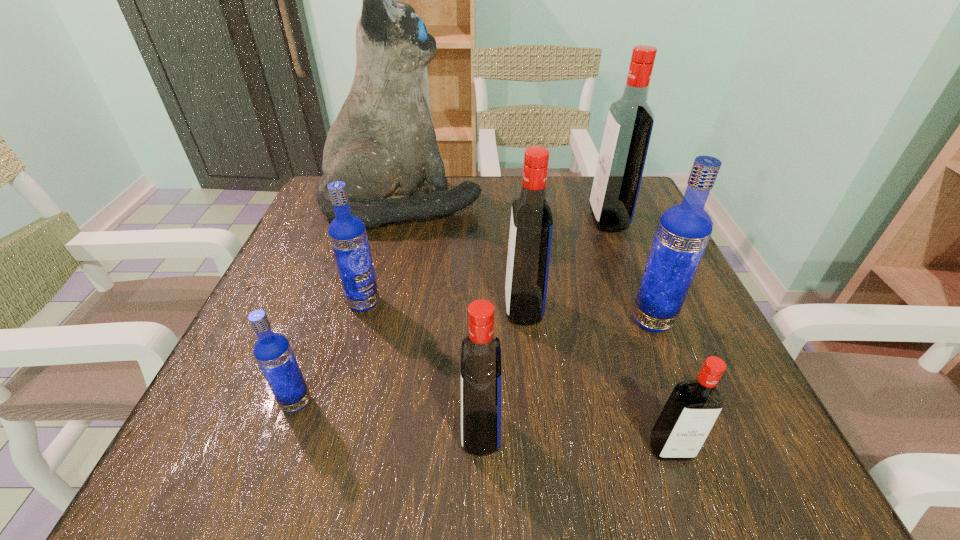
At what (x,y) coordinates should I click in order to perform the action: click on blue vodka that stands as the closest to the leftmost vodka. Please return your answer as a coordinate pair (x, y). Looking at the image, I should click on (347, 233).

Identify the location of the second closest blue vodka to the sixth vodka from right to left. (683, 232).

Identify the location of vacant space that satisfies the following two spatial constraints: 1. on the front and back of the fourth vodka from left to right; 2. on the right side of the rightmost blue vodka. (525, 320).

Where is `free space that satisfies the following two spatial constraints: 1. on the front and back of the farthest red vodka; 2. on the front side of the second biggest blue vodka`? free space that satisfies the following two spatial constraints: 1. on the front and back of the farthest red vodka; 2. on the front side of the second biggest blue vodka is located at coordinates (640, 303).

The image size is (960, 540). In order to click on free point that satisfies the following two spatial constraints: 1. on the front and back of the fourth vodka from left to right; 2. on the back side of the rightmost blue vodka in this screenshot , I will do `click(525, 320)`.